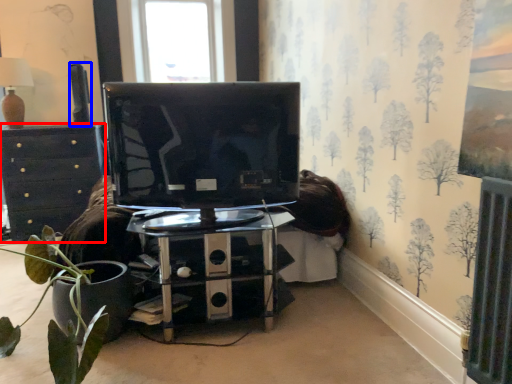
Question: Which object is closer to the camera taking this photo, chest of drawers (highlighted by a red box) or speaker (highlighted by a blue box)?

Choices:
 (A) chest of drawers
 (B) speaker

Answer: (A)